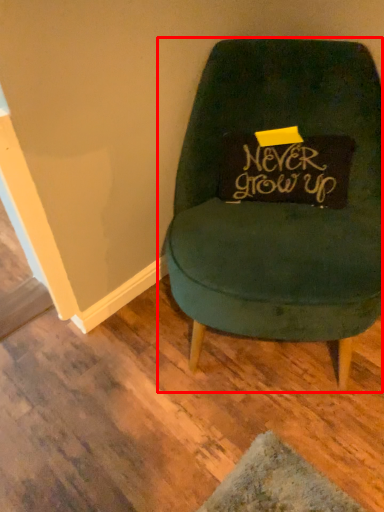
Question: From the image's perspective, where is chair (annotated by the red box) located relative to writing?

Choices:
 (A) above
 (B) below

Answer: (B)